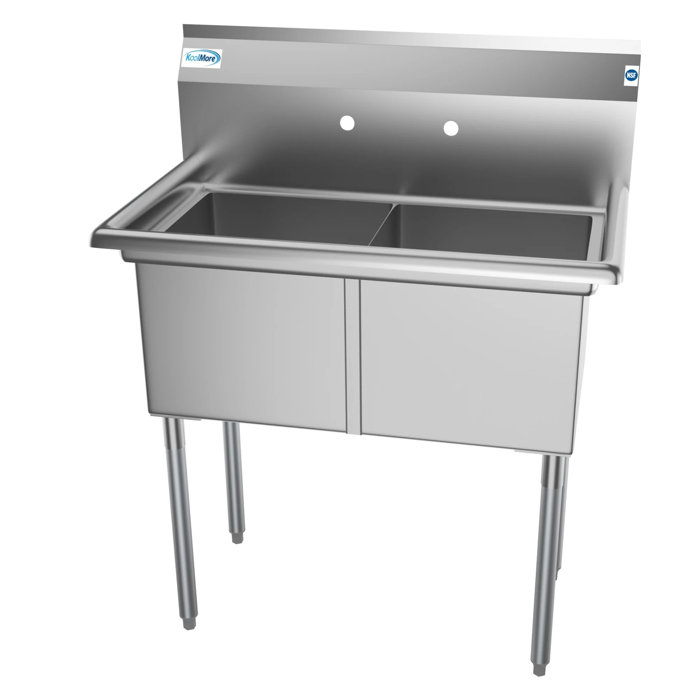
Find the location of a particular element. back wall is located at coordinates (435, 231).